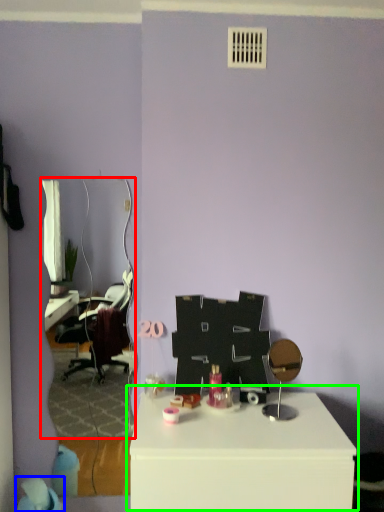
Question: Which is nearer to the mirror (highlighted by a red box)? bean bag chair (highlighted by a blue box) or table (highlighted by a green box).

Choices:
 (A) bean bag chair
 (B) table

Answer: (A)